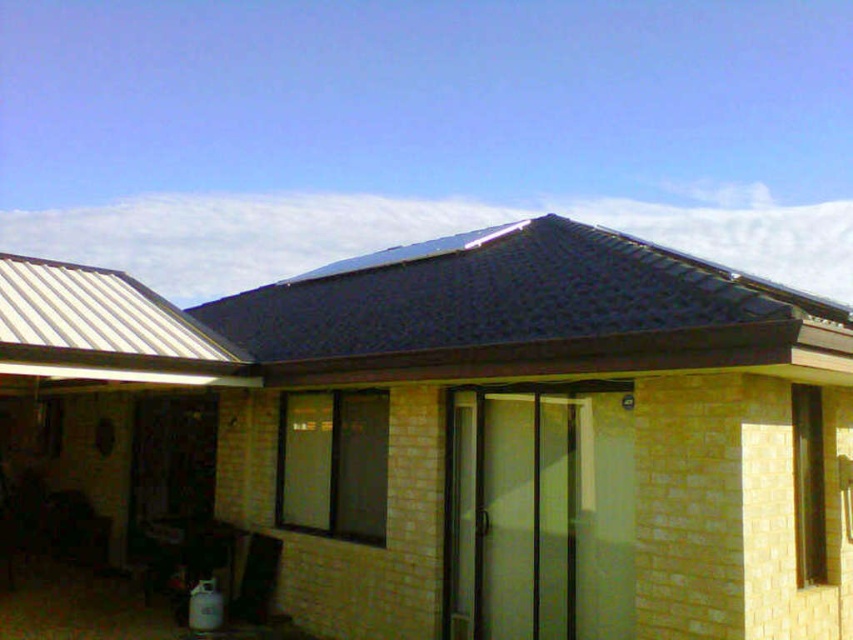
Measure the distance between yellow brick shed at center and camera.

A distance of 15.90 feet exists between yellow brick shed at center and camera.

Find the location of a particular element. This screenshot has width=853, height=640. yellow brick shed at center is located at coordinates (474, 435).

Is point (572, 428) closer to viewer compared to point (614, 259)?

Yes, it is in front of point (614, 259).

The width and height of the screenshot is (853, 640). Find the location of `yellow brick shed at center`. yellow brick shed at center is located at coordinates (474, 435).